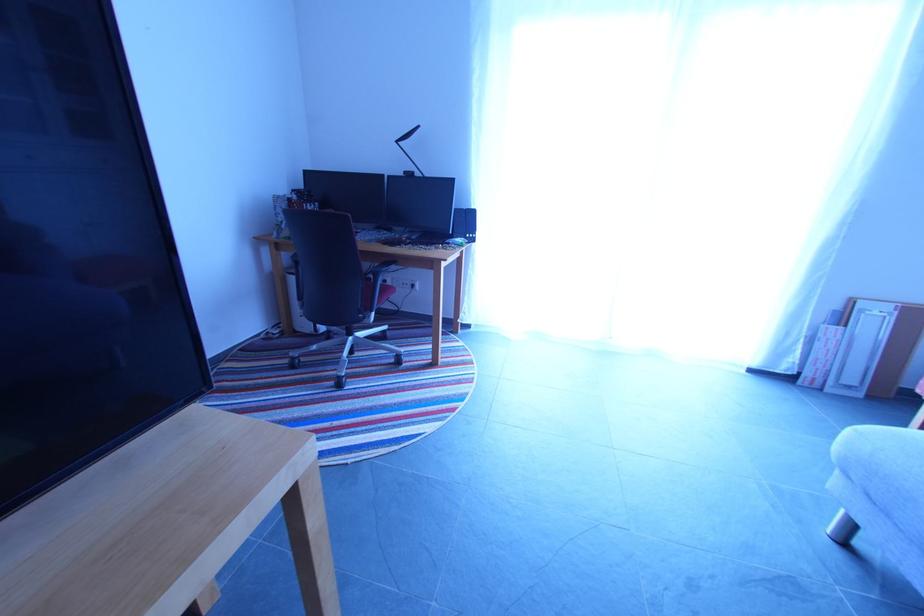
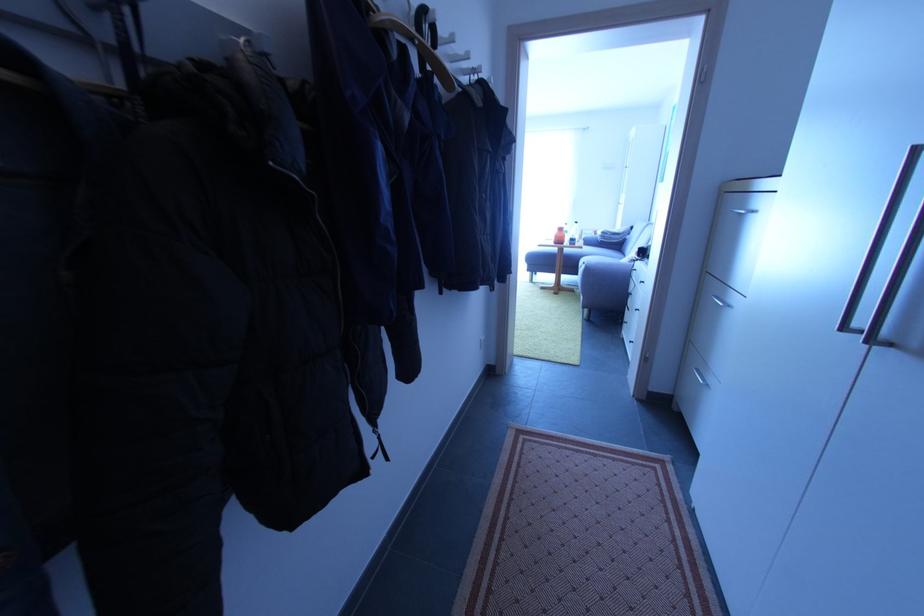
The point at (845, 321) is marked in the first image. Where is the corresponding point in the second image?

(585, 238)